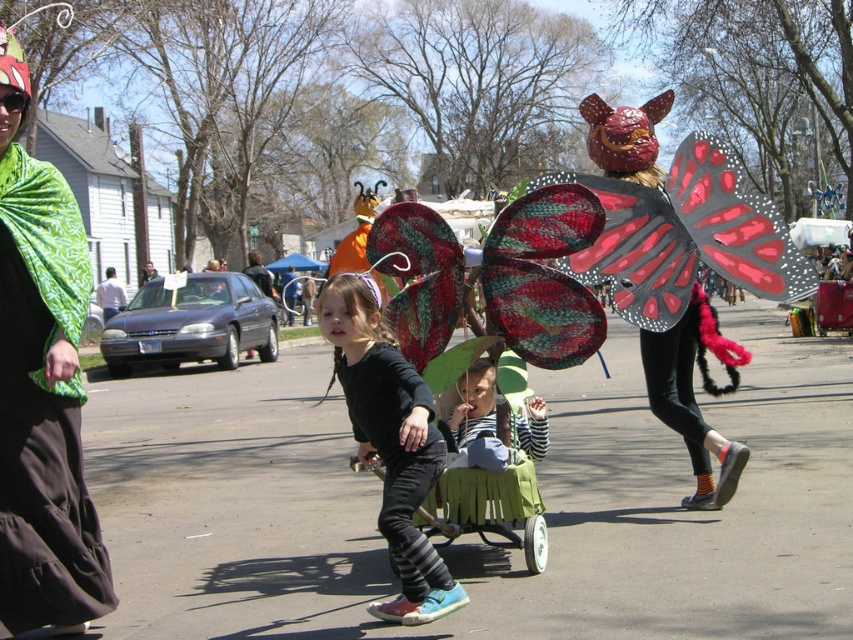
Question: Can you confirm if black matte leggings at center is positioned to the right of striped fabric at center?

Choices:
 (A) yes
 (B) no

Answer: (B)

Question: Which point is farther to the camera?

Choices:
 (A) green patterned scarf at left
 (B) black matte leggings at center

Answer: (B)

Question: Does green patterned scarf at left lie in front of striped fabric at center?

Choices:
 (A) no
 (B) yes

Answer: (B)

Question: Which object is the farthest from the striped fabric at center?

Choices:
 (A) green patterned scarf at left
 (B) black matte leggings at center

Answer: (A)

Question: Can you confirm if black matte leggings at center is bigger than striped fabric at center?

Choices:
 (A) no
 (B) yes

Answer: (B)

Question: Which point is farther from the camera taking this photo?

Choices:
 (A) (57, 180)
 (B) (409, 486)

Answer: (A)